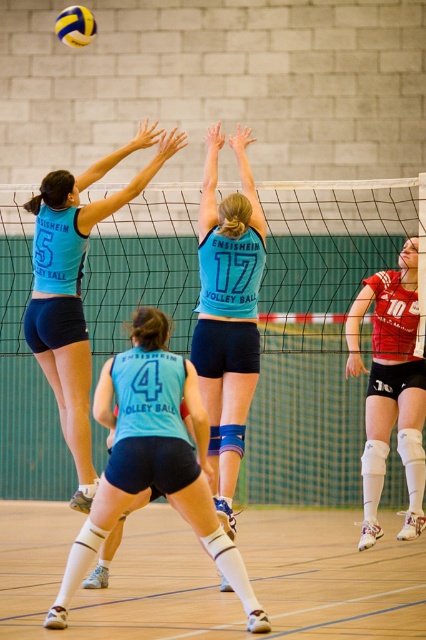
Question: Which of these objects is positioned farthest from the yellow/yellowish matte/volleyball at upper left?

Choices:
 (A) matte blue jersey at center
 (B) matte blue jersey at upper left

Answer: (A)

Question: Does matte blue jersey at center lie behind red jersey knee pads at right?

Choices:
 (A) yes
 (B) no

Answer: (B)

Question: Which point is closer to the camera taking this photo?

Choices:
 (A) (402, 540)
 (B) (98, 413)
 (C) (167, 196)

Answer: (B)

Question: In this image, where is matte blue jersey at center located relative to yellow/yellowish matte/volleyball at upper left?

Choices:
 (A) above
 (B) below

Answer: (B)

Question: Does black mesh net at center have a smaller size compared to matte blue jersey at center?

Choices:
 (A) yes
 (B) no

Answer: (B)

Question: Which object is farther from the camera taking this photo?

Choices:
 (A) black mesh net at center
 (B) matte blue jersey at upper left

Answer: (A)